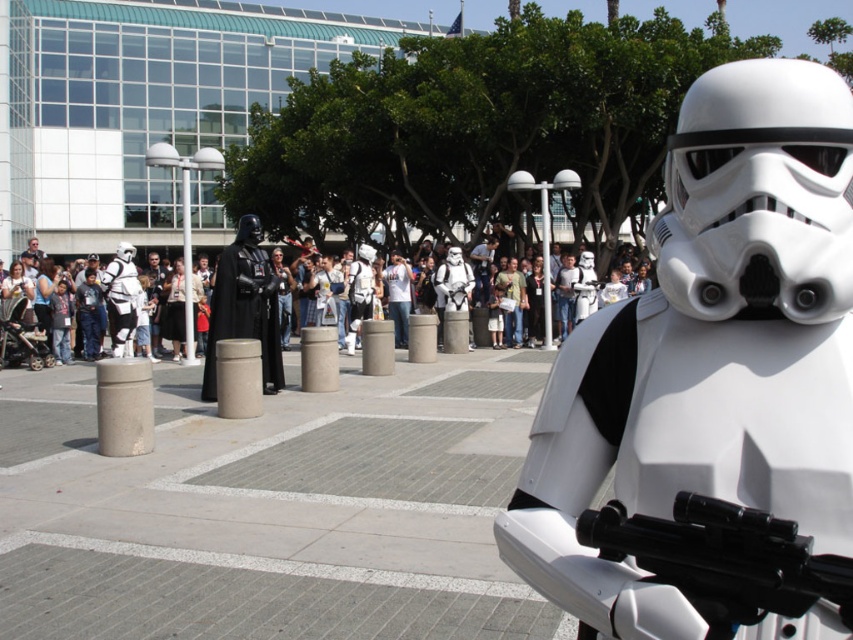
Question: Is white matte stormtrooper helmet at center thinner than black plastic gun at lower right?

Choices:
 (A) yes
 (B) no

Answer: (B)

Question: Which point appears farthest from the camera in this image?

Choices:
 (A) (654, 284)
 (B) (741, 605)
 (C) (218, 332)

Answer: (A)

Question: Which object is farther from the camera taking this photo?

Choices:
 (A) white matte stormtrooper helmet at center
 (B) matte black armor at center
 (C) black plastic gun at lower right

Answer: (B)

Question: Which of the following is the farthest from the observer?

Choices:
 (A) (796, 467)
 (B) (247, 282)
 (C) (123, 260)
 (D) (675, 586)

Answer: (C)

Question: Does black plastic gun at lower right have a smaller size compared to matte black armor at center?

Choices:
 (A) yes
 (B) no

Answer: (A)

Question: Is white matte stormtrooper helmet at center bigger than white matte stormtrooper at center?

Choices:
 (A) yes
 (B) no

Answer: (B)